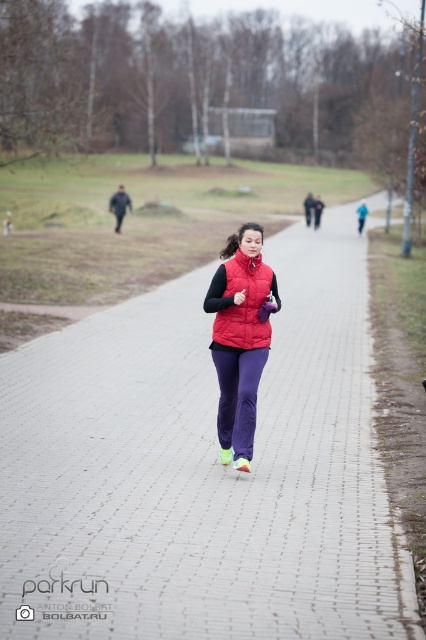
Can you confirm if brick paved path at center is positioned to the right of matte red vest at center?

Incorrect, brick paved path at center is not on the right side of matte red vest at center.

Is brick paved path at center taller than matte red vest at center?

Yes, brick paved path at center is taller than matte red vest at center.

Between point (310, 593) and point (261, 259), which one is positioned behind?

Positioned behind is point (261, 259).

The image size is (426, 640). I want to click on brick paved path at center, so click(204, 468).

What do you see at coordinates (239, 339) in the screenshot? I see `matte red vest at center` at bounding box center [239, 339].

Between matte red vest at center and red puffer vest at center, which one is positioned higher?

red puffer vest at center is above.

Is point (218, 384) in front of point (271, 284)?

Yes, point (218, 384) is in front of point (271, 284).

At what (x,y) coordinates should I click in order to perform the action: click on matte red vest at center. Please return your answer as a coordinate pair (x, y). The width and height of the screenshot is (426, 640). Looking at the image, I should click on (239, 339).

Between brick paved path at center and red puffer vest at center, which one has more height?

Standing taller between the two is brick paved path at center.

Is brick paved path at center to the left of red puffer vest at center from the viewer's perspective?

Indeed, brick paved path at center is positioned on the left side of red puffer vest at center.

Locate an element on the screen. This screenshot has height=640, width=426. brick paved path at center is located at coordinates (204, 468).